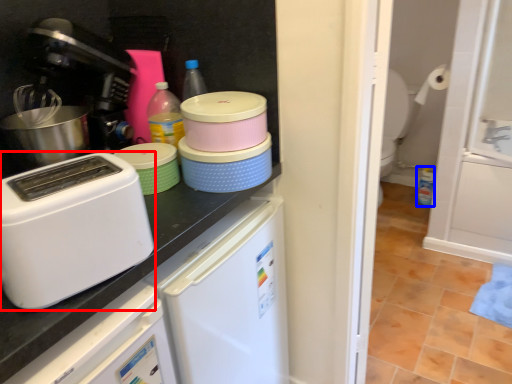
Question: Which of the following is the closest to the observer, home appliance (highlighted by a red box) or bottle (highlighted by a blue box)?

Choices:
 (A) home appliance
 (B) bottle

Answer: (A)